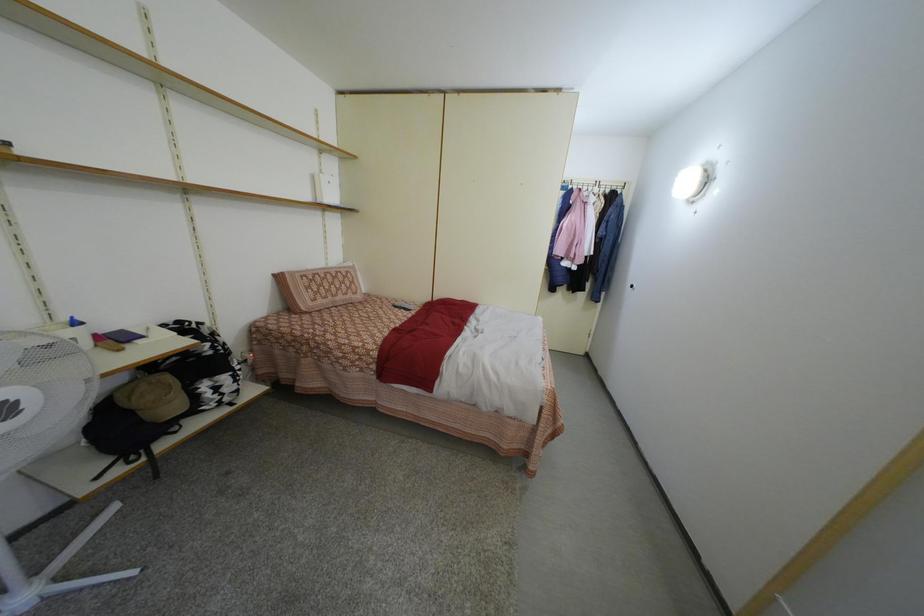
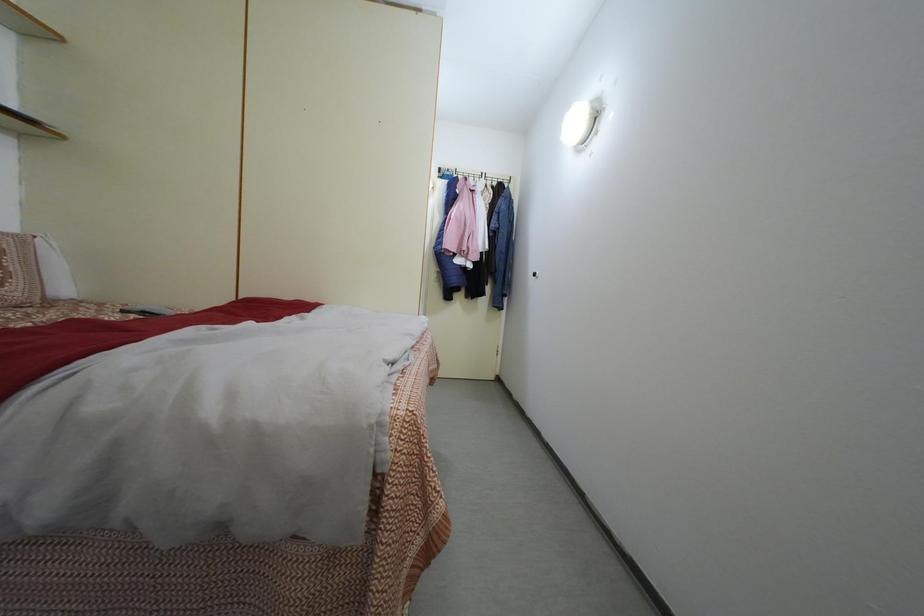
From the picture: What movement of the cameraman would produce the second image?

The movement direction of the cameraman is right, forward.